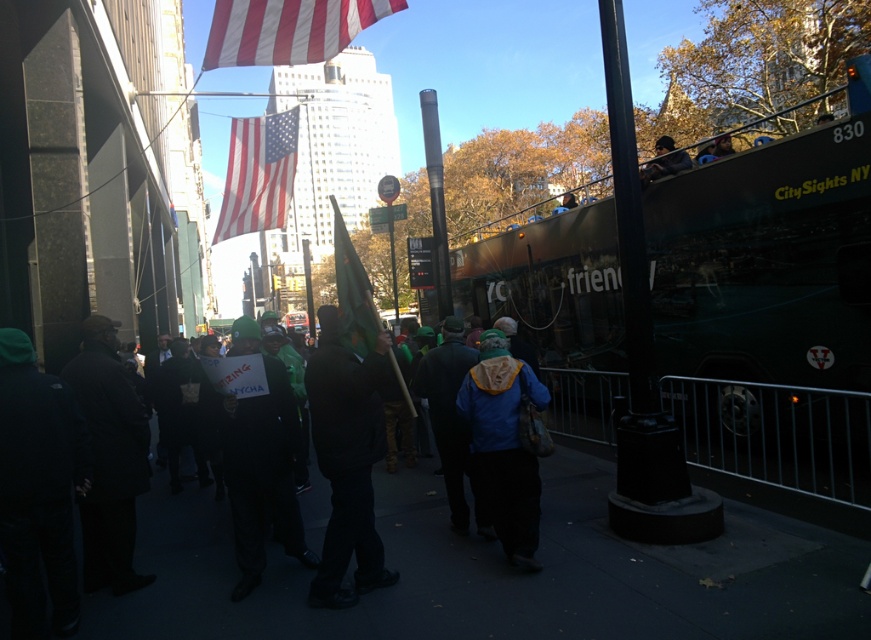
You are a photographer trying to capture a clear shot of the dark gray coat at left without the black matte jacket at center blocking it. What should you do?

The black matte jacket at center is in front of the dark gray coat at left, so you should move to the side to get a clear shot of the dark gray coat at left without obstruction.

From the picture: You are a photographer standing in the crowd and want to take a photo of both the black matte jacket at center and the dark gray coat at left. Which of the two items should you focus on first if you want to capture them both in the frame without moving your camera?

You should focus on the dark gray coat at left first because it is wider than the black matte jacket at center, ensuring it fits better in the frame.